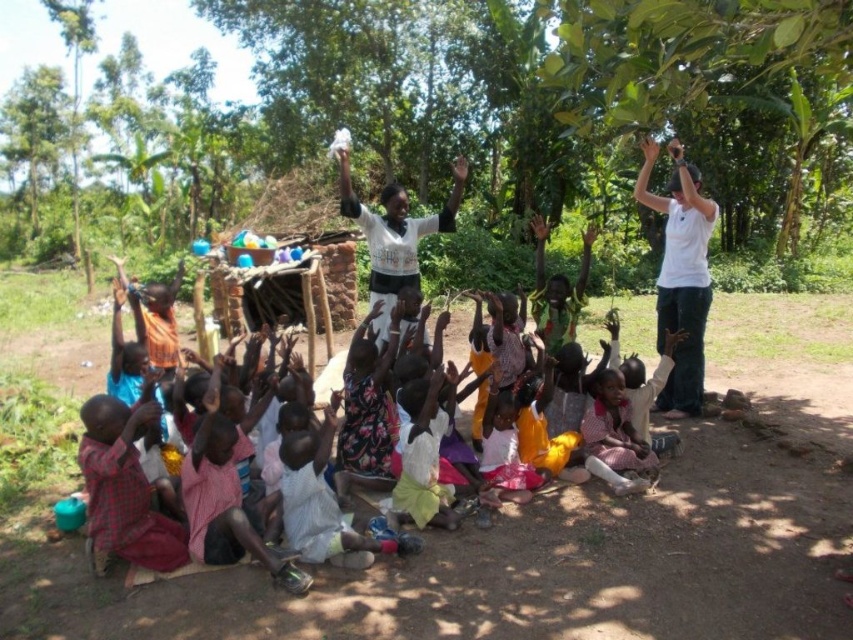
Between green leafy tree at upper center and yellow fabric shirt at center, which one is positioned lower?

Positioned lower is yellow fabric shirt at center.

Can you confirm if green leafy tree at upper center is smaller than yellow fabric shirt at center?

Incorrect, green leafy tree at upper center is not smaller in size than yellow fabric shirt at center.

Does point (103, 230) lie in front of point (587, 260)?

No, (103, 230) is behind (587, 260).

The height and width of the screenshot is (640, 853). What are the coordinates of `green leafy tree at upper center` in the screenshot? It's located at (433, 120).

Does brown dirt field at center have a greater width compared to white cotton shirt at center?

Yes, brown dirt field at center is wider than white cotton shirt at center.

Find the location of a particular element. brown dirt field at center is located at coordinates (564, 536).

Find the location of `brown dirt field at center`. brown dirt field at center is located at coordinates (564, 536).

This screenshot has width=853, height=640. I want to click on white cotton shirt at center, so click(392, 230).

In order to click on white cotton shirt at center in this screenshot , I will do `click(392, 230)`.